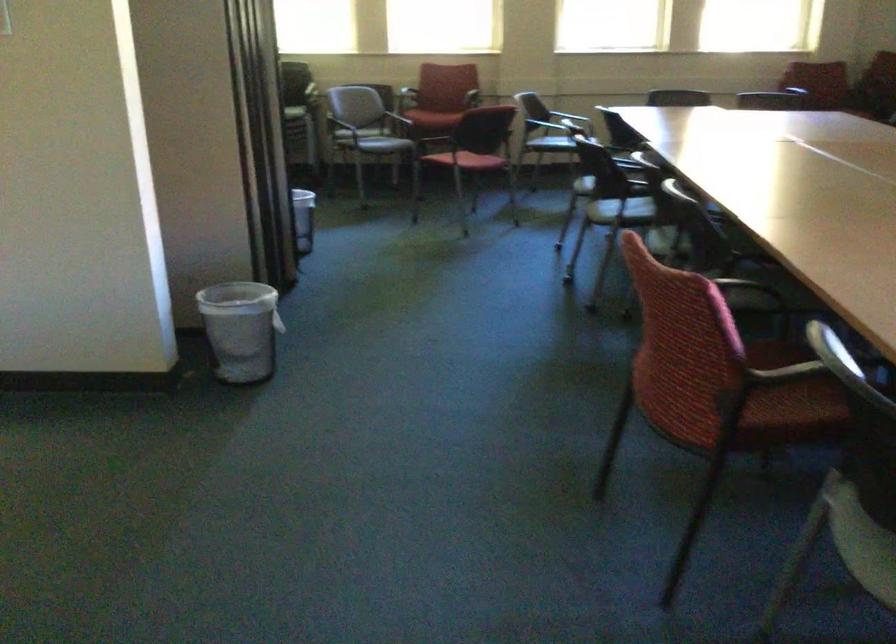
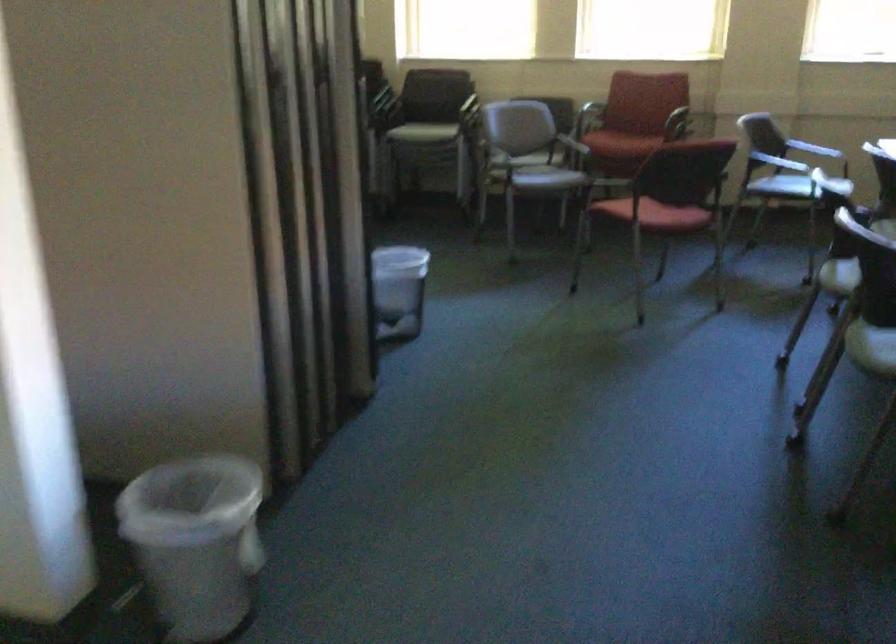
In the second image, find the point that corresponds to (561,136) in the first image.

(780, 162)